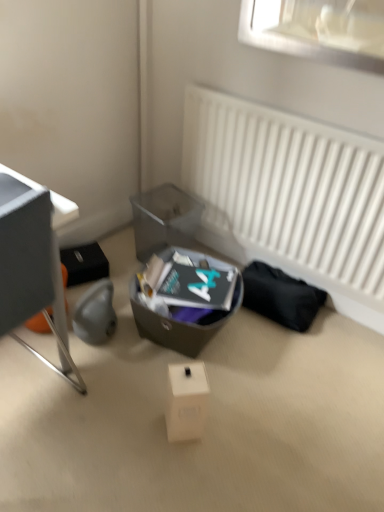
Question: From the image's perspective, would you say metallic gray desk at left is shown under matte gray box at center?

Choices:
 (A) no
 (B) yes

Answer: (A)

Question: From a real-world perspective, is metallic gray desk at left physically above matte gray box at center?

Choices:
 (A) yes
 (B) no

Answer: (A)

Question: Is metallic gray desk at left positioned in front of matte gray box at center?

Choices:
 (A) yes
 (B) no

Answer: (A)

Question: Does metallic gray desk at left appear on the left side of matte gray box at center?

Choices:
 (A) no
 (B) yes

Answer: (B)

Question: Does metallic gray desk at left have a larger size compared to matte gray box at center?

Choices:
 (A) yes
 (B) no

Answer: (A)

Question: Does point (233, 295) appear closer or farther from the camera than point (309, 250)?

Choices:
 (A) farther
 (B) closer

Answer: (B)

Question: Relative to white matte radiator at upper right, is matte gray box at center in front or behind?

Choices:
 (A) behind
 (B) front

Answer: (A)

Question: From the image's perspective, is matte gray box at center located above or below white matte radiator at upper right?

Choices:
 (A) above
 (B) below

Answer: (B)

Question: In the image, is matte gray box at center on the left side or the right side of white matte radiator at upper right?

Choices:
 (A) right
 (B) left

Answer: (B)

Question: In terms of height, does metallic gray desk at left look taller or shorter compared to white matte cardboard box at center?

Choices:
 (A) short
 (B) tall

Answer: (B)

Question: Is metallic gray desk at left wider or thinner than white matte cardboard box at center?

Choices:
 (A) wide
 (B) thin

Answer: (A)

Question: Considering the relative positions of metallic gray desk at left and white matte cardboard box at center in the image provided, is metallic gray desk at left to the left or to the right of white matte cardboard box at center?

Choices:
 (A) left
 (B) right

Answer: (A)

Question: Relative to white matte cardboard box at center, is metallic gray desk at left in front or behind?

Choices:
 (A) front
 (B) behind

Answer: (A)

Question: Do you think translucent plastic shoe box at center is within matte gray box at center, or outside of it?

Choices:
 (A) outside
 (B) inside

Answer: (A)

Question: Is translucent plastic shoe box at center taller or shorter than matte gray box at center?

Choices:
 (A) tall
 (B) short

Answer: (A)